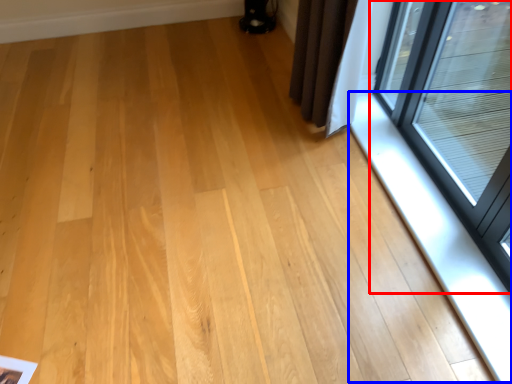
Question: Which point is further to the camera, window (highlighted by a red box) or window sill (highlighted by a blue box)?

Choices:
 (A) window
 (B) window sill

Answer: (B)